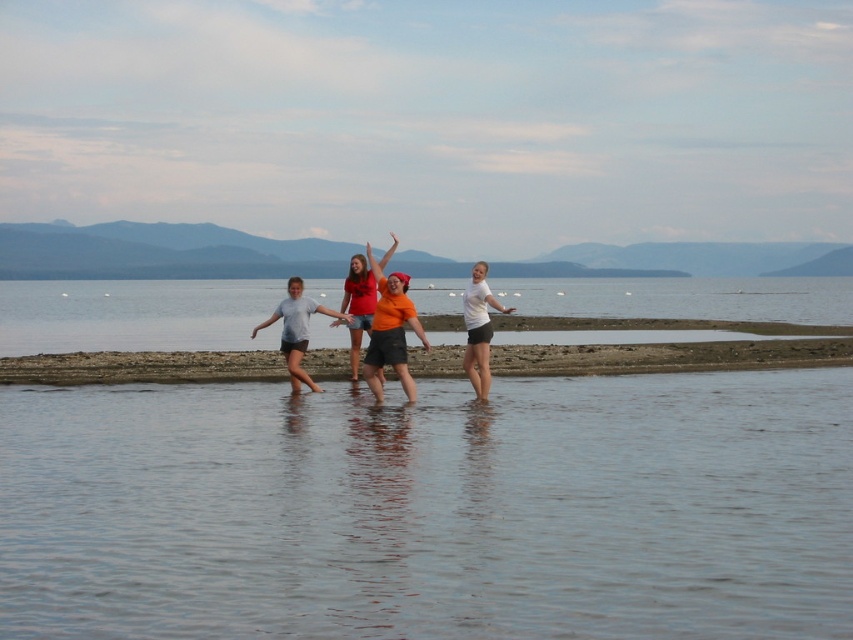
You are a photographer trying to capture a group photo of the orange matte shirt at center and the clear water at lower center. Based on their heights, which one should you focus on first to ensure proper focus?

The orange matte shirt at center should be focused on first because it is taller than the clear water at lower center. Since the clear water at lower center is not as tall as the orange matte shirt at center, focusing on the taller object ensures better depth of field coverage for both subjects.